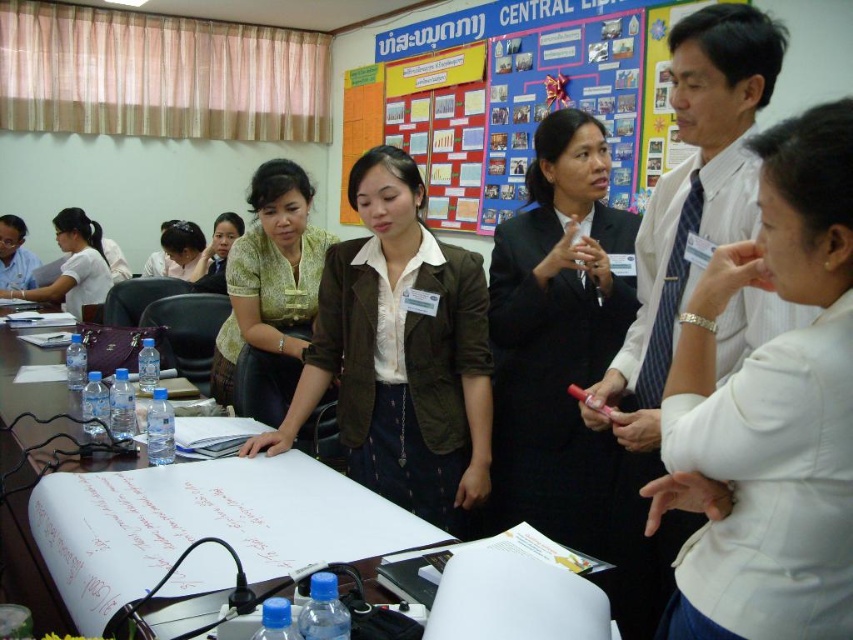
Question: Which object is positioned closest to the matte yellow blouse at center?

Choices:
 (A) black suit at center
 (B) matte green blouse at center

Answer: (A)

Question: Which point is farther to the camera?

Choices:
 (A) white fabric shirt at center
 (B) brown fabric jacket at center

Answer: (B)

Question: Is brown fabric jacket at center to the right of matte yellow blouse at center from the viewer's perspective?

Choices:
 (A) no
 (B) yes

Answer: (B)

Question: Is white fabric shirt at center below brown fabric jacket at center?

Choices:
 (A) yes
 (B) no

Answer: (A)

Question: Can you confirm if matte yellow blouse at center is positioned to the left of matte black hairband at upper left?

Choices:
 (A) no
 (B) yes

Answer: (A)

Question: Which object is farther from the camera taking this photo?

Choices:
 (A) white matte shirt at left
 (B) blue fabric bulletin board at upper center
 (C) black suit at center

Answer: (A)